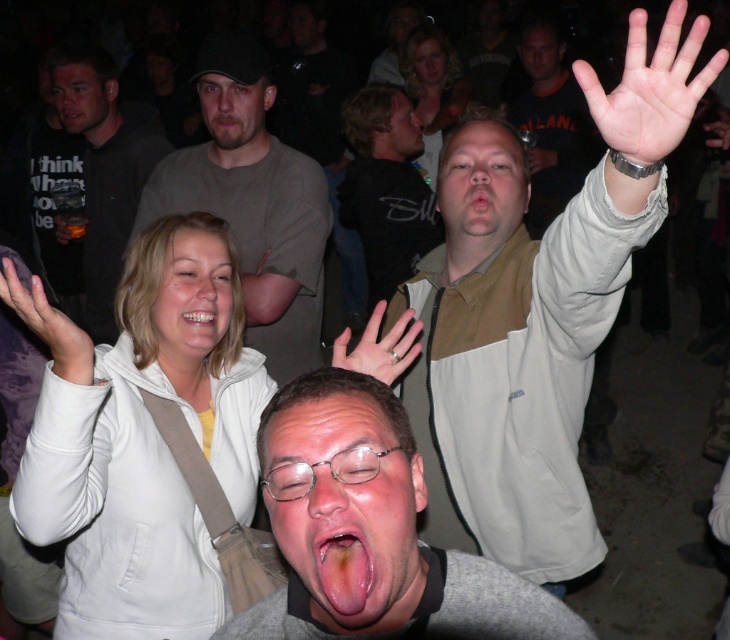
You are a photographer trying to capture the perfect shot of the black cotton shirt at center and the pinkish skin hand at center. If you want to ensure both are fully visible in the frame, which object should you focus on to avoid cropping?

The black cotton shirt at center has a larger width than the pinkish skin hand at center, so focusing on the black cotton shirt at center will ensure both are fully visible without cropping.